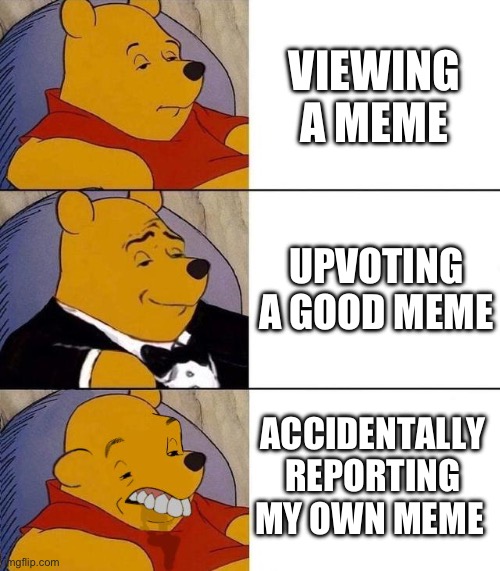
You are a GUI agent. You are given a task and a screenshot of the screen. Output one action in this format:
    pyautogui.click(x=<x>, y=<y>)
    Task: Click on the chair
    The image size is (500, 571).
    Given the screenshot: What is the action you would take?
    pyautogui.click(x=23, y=76), pyautogui.click(x=19, y=262), pyautogui.click(x=21, y=463)